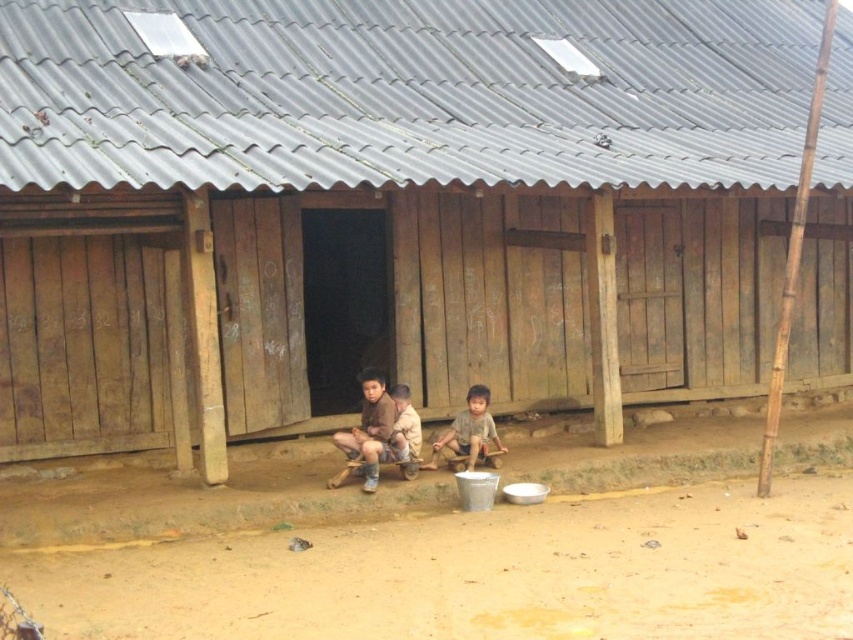
Question: Which of the following is the closest to the observer?

Choices:
 (A) brown leather shoes at center
 (B) brown sandy dirt at lower center

Answer: (B)

Question: Is brown wooden boy at center to the right of brown leather shoes at center from the viewer's perspective?

Choices:
 (A) yes
 (B) no

Answer: (B)

Question: Which is farther from the brown leather shoes at center?

Choices:
 (A) brown wooden boy at center
 (B) brown sandy dirt at lower center

Answer: (B)

Question: Can you confirm if brown wooden boy at center is positioned above brown leather shoes at center?

Choices:
 (A) yes
 (B) no

Answer: (A)

Question: Which point is farther to the camera?

Choices:
 (A) (339, 435)
 (B) (486, 403)
 (C) (212, 536)

Answer: (B)

Question: Is brown wooden boy at center bigger than brown leather shoes at center?

Choices:
 (A) no
 (B) yes

Answer: (B)